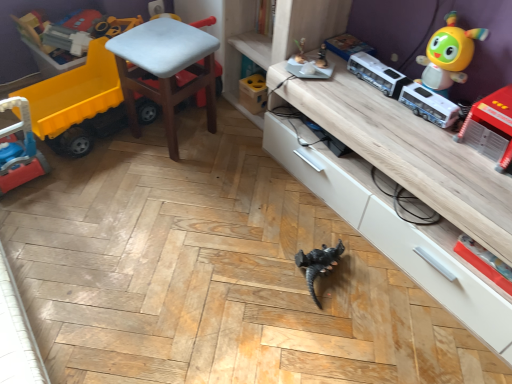
Question: Should I look upward or downward to see white plastic chair at center?

Choices:
 (A) up
 (B) down

Answer: (A)

Question: Does shiny yellow toy at upper right, the second toy viewed from the right, lie behind wooden shelf at center?

Choices:
 (A) no
 (B) yes

Answer: (A)

Question: Can you confirm if shiny yellow toy at upper right, the second toy viewed from the right, is wider than wooden shelf at center?

Choices:
 (A) yes
 (B) no

Answer: (B)

Question: From a real-world perspective, is shiny yellow toy at upper right, which appears as the fourth toy when viewed from the left, beneath wooden shelf at center?

Choices:
 (A) no
 (B) yes

Answer: (A)

Question: Considering the relative positions of shiny yellow toy at upper right, the second toy viewed from the right, and wooden shelf at center in the image provided, is shiny yellow toy at upper right, the second toy viewed from the right, to the right of wooden shelf at center from the viewer's perspective?

Choices:
 (A) no
 (B) yes

Answer: (B)

Question: From the image's perspective, would you say shiny yellow toy at upper right, which appears as the fourth toy when viewed from the left, is shown under wooden shelf at center?

Choices:
 (A) yes
 (B) no

Answer: (A)

Question: Could you tell me if shiny yellow toy at upper right, which appears as the fourth toy when viewed from the left, is facing wooden shelf at center?

Choices:
 (A) yes
 (B) no

Answer: (B)

Question: Can you confirm if matte blue book at upper center, the third toy positioned from the left, is bigger than white plastic bus at upper right?

Choices:
 (A) no
 (B) yes

Answer: (A)

Question: Is white plastic bus at upper right completely or partially inside matte blue book at upper center, the third toy positioned from the left?

Choices:
 (A) no
 (B) yes

Answer: (A)

Question: Is matte blue book at upper center, acting as the 3th toy starting from the right, positioned before white plastic bus at upper right?

Choices:
 (A) yes
 (B) no

Answer: (B)

Question: Is matte blue book at upper center, the third toy positioned from the left, looking in the opposite direction of white plastic bus at upper right?

Choices:
 (A) yes
 (B) no

Answer: (B)

Question: From the image's perspective, is matte blue book at upper center, the third toy positioned from the left, beneath white plastic bus at upper right?

Choices:
 (A) no
 (B) yes

Answer: (A)

Question: Is matte blue book at upper center, acting as the 3th toy starting from the right, shorter than white plastic bus at upper right?

Choices:
 (A) no
 (B) yes

Answer: (B)